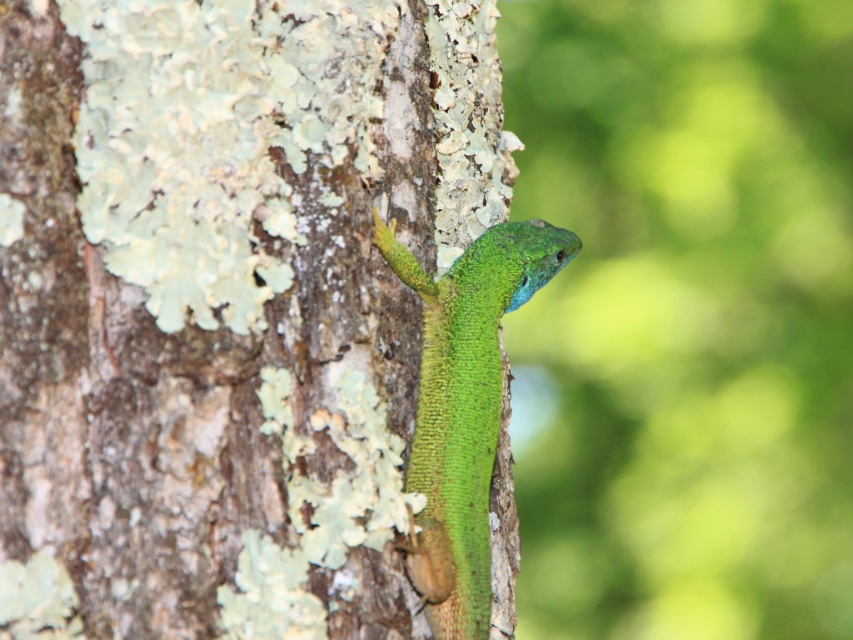
Question: Which point is closer to the camera?

Choices:
 (A) green matte lizard at center
 (B) green rough bark tree at center

Answer: (B)

Question: Is green rough bark tree at center positioned behind green matte lizard at center?

Choices:
 (A) no
 (B) yes

Answer: (A)

Question: Among these points, which one is farthest from the camera?

Choices:
 (A) (76, 106)
 (B) (456, 422)

Answer: (B)

Question: Can you confirm if green rough bark tree at center is positioned to the left of green matte lizard at center?

Choices:
 (A) yes
 (B) no

Answer: (A)

Question: Is green rough bark tree at center above green matte lizard at center?

Choices:
 (A) yes
 (B) no

Answer: (A)

Question: Which of the following is the closest to the observer?

Choices:
 (A) (456, 259)
 (B) (474, 186)

Answer: (A)